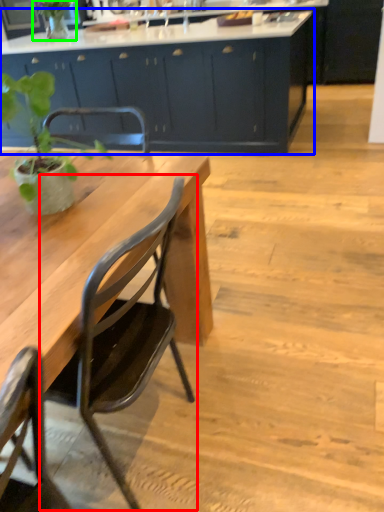
Question: Which object is the closest to the chair (highlighted by a red box)? Choose among these: cabinetry (highlighted by a blue box) or plant (highlighted by a green box).

Choices:
 (A) cabinetry
 (B) plant

Answer: (A)